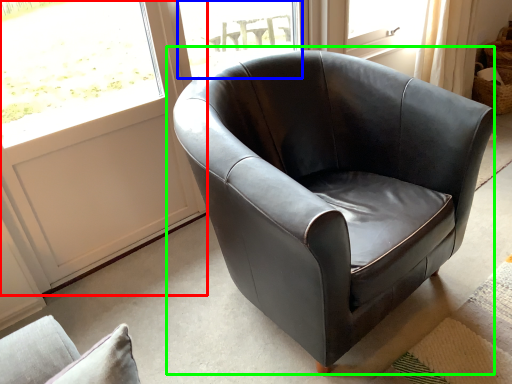
Question: Which object is positioned farthest from screen door (highlighted by a red box)? Select from window (highlighted by a blue box) and chair (highlighted by a green box).

Choices:
 (A) window
 (B) chair

Answer: (B)